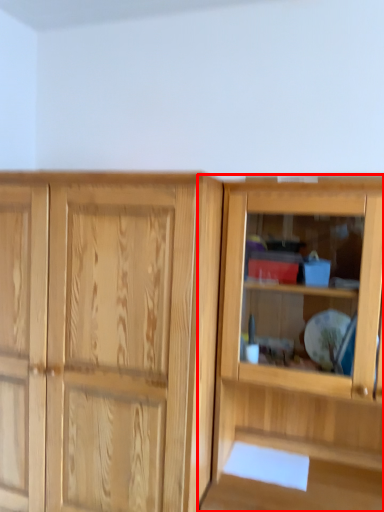
Question: Considering the relative positions of cupboard (annotated by the red box) and screen door in the image provided, where is cupboard (annotated by the red box) located with respect to the staircase?

Choices:
 (A) right
 (B) left

Answer: (A)